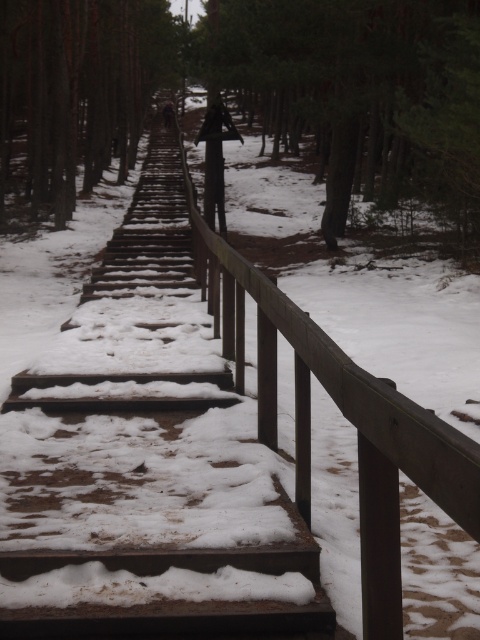
Find the location of `wooden stairs at center`. wooden stairs at center is located at coordinates (147, 458).

Does point (134, 413) lie in front of point (463, 141)?

Yes, point (134, 413) is closer to viewer.

You are a GUI agent. You are given a task and a screenshot of the screen. Output one action in this format:
    pyautogui.click(x=<x>, y=<y>)
    Task: Click on the wooden stairs at center
    This screenshot has height=640, width=480.
    Given the screenshot: What is the action you would take?
    147,458

Does wooden stairs at center have a greater height compared to dark brown wooden post at center?

Incorrect, wooden stairs at center's height is not larger of dark brown wooden post at center's.

Image resolution: width=480 pixels, height=640 pixels. I want to click on wooden stairs at center, so click(147, 458).

Is brown wooden post at center behind dark brown wooden post at center?

Yes, brown wooden post at center is further from the viewer.

Does brown wooden post at center appear on the left side of dark brown wooden post at center?

Indeed, brown wooden post at center is positioned on the left side of dark brown wooden post at center.

Which is in front, point (11, 51) or point (219, 220)?

Positioned in front is point (219, 220).

At what (x,y) coordinates should I click in order to perform the action: click on brown wooden post at center. Please return your answer as a coordinate pair (x, y). Looking at the image, I should click on (75, 92).